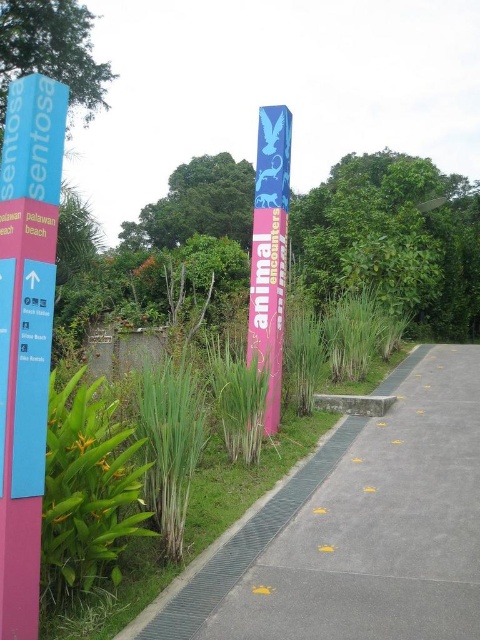
Question: Is blue plastic sign at left below pink glossy pole at center?

Choices:
 (A) yes
 (B) no

Answer: (A)

Question: Does blue plastic sign at left lie in front of pink glossy pole at center?

Choices:
 (A) yes
 (B) no

Answer: (A)

Question: Among these objects, which one is farthest from the camera?

Choices:
 (A) blue plastic sign at left
 (B) pink glossy pole at center

Answer: (B)

Question: Is blue plastic sign at left to the left of pink glossy pole at center from the viewer's perspective?

Choices:
 (A) no
 (B) yes

Answer: (B)